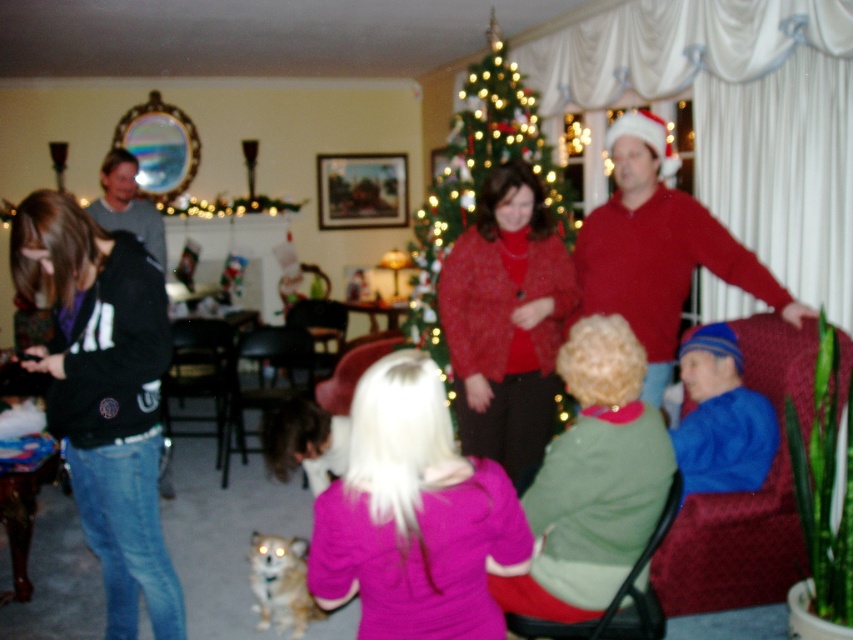
You are standing in the room and want to place a new decoration exactly at the center of the room. The current green textured christmas tree at center is located at point 0.298, 0.562. Is the tree currently positioned at the center of the room?

The green textured christmas tree at center is located at point (479, 189), which is not the exact center of the room. The center would be at point (426, 320), so the tree is slightly to the left and lower than the true center.

You are standing in the festive room and want to take a photo. You notice two points in the scene marked as point 1 at coordinates (735,541) and point 2 at coordinates (173,339). Which point will appear larger in your camera view?

Point 1 at coordinates (735,541) will appear larger in the camera view because it is closer to the camera than point 2 at coordinates (173,339).

You are standing at the origin of the coordinate system in the room. The green textured christmas tree at center is located at point (479,189). If you want to walk directly towards it, which direction should you move?

Since the green textured christmas tree at center is located at point (479,189), you should move in the direction of that coordinate to reach it.